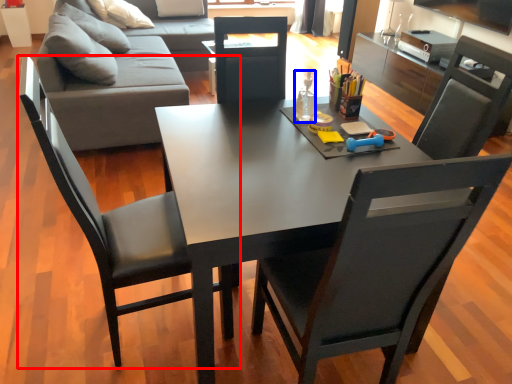
Question: Which object is closer to the camera taking this photo, chair (highlighted by a red box) or bottle (highlighted by a blue box)?

Choices:
 (A) chair
 (B) bottle

Answer: (A)